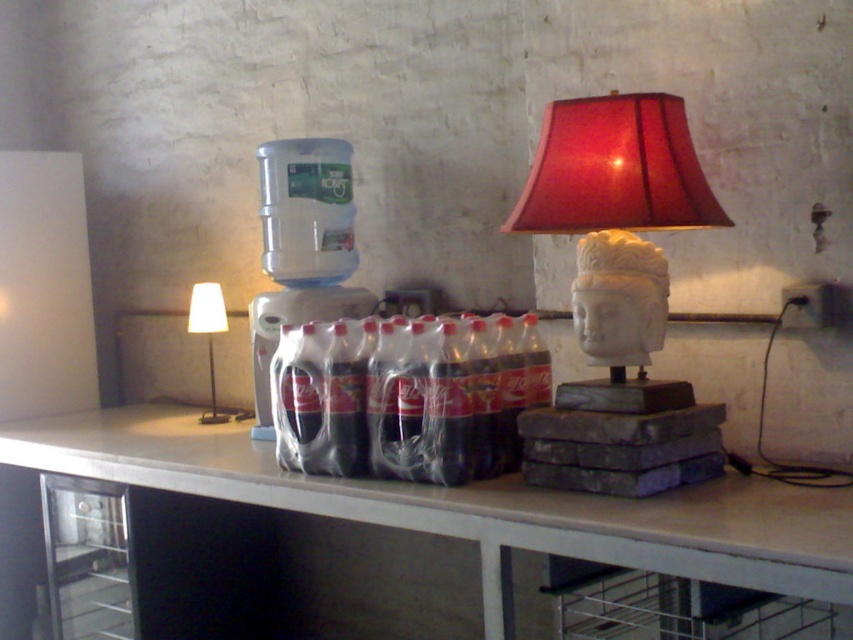
Locate an element on the screen. white concrete table at center is located at coordinates (474, 506).

Can you confirm if white concrete table at center is smaller than white fabric lampshade at left?

Incorrect, white concrete table at center is not smaller in size than white fabric lampshade at left.

Does point (508, 512) come closer to viewer compared to point (196, 332)?

Yes.

You are a GUI agent. You are given a task and a screenshot of the screen. Output one action in this format:
    pyautogui.click(x=<x>, y=<y>)
    Task: Click on the white concrete table at center
    The height and width of the screenshot is (640, 853).
    Given the screenshot: What is the action you would take?
    pyautogui.click(x=474, y=506)

Does matte white head at upper right have a lesser height compared to white fabric lampshade at left?

No.

Is point (660, 188) closer to camera compared to point (195, 316)?

That is True.

Image resolution: width=853 pixels, height=640 pixels. What are the coordinates of `matte white head at upper right` in the screenshot? It's located at (614, 170).

Is point (489, 563) farther from camera compared to point (666, 132)?

No, it is not.

Who is lower down, white concrete table at center or matte white head at upper right?

white concrete table at center is lower down.

Does point (485, 582) lie behind point (610, 221)?

No.

Where is `white concrete table at center`? This screenshot has height=640, width=853. white concrete table at center is located at coordinates (474, 506).